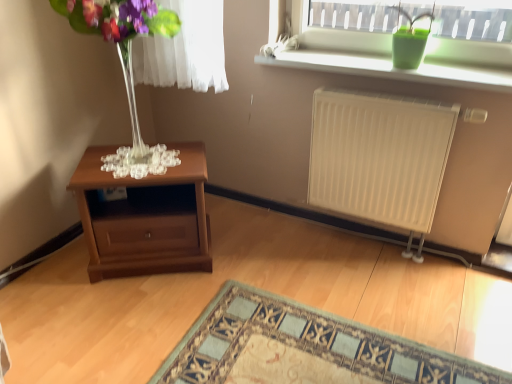
Question: Would you say green matte vase at upper right is a long distance from white matte radiator at right?

Choices:
 (A) yes
 (B) no

Answer: (B)

Question: Does green matte vase at upper right have a larger size compared to white matte radiator at right?

Choices:
 (A) yes
 (B) no

Answer: (B)

Question: Can you confirm if green matte vase at upper right is shorter than white matte radiator at right?

Choices:
 (A) yes
 (B) no

Answer: (A)

Question: Would you say white matte radiator at right is part of green matte vase at upper right's contents?

Choices:
 (A) no
 (B) yes

Answer: (A)

Question: Does green matte vase at upper right appear on the right side of white matte radiator at right?

Choices:
 (A) yes
 (B) no

Answer: (A)

Question: Would you say green matte vase at upper right is to the left or to the right of transparent glass vase at left in the picture?

Choices:
 (A) right
 (B) left

Answer: (A)

Question: Relative to transparent glass vase at left, is green matte vase at upper right in front or behind?

Choices:
 (A) behind
 (B) front

Answer: (A)

Question: Is green matte vase at upper right bigger or smaller than transparent glass vase at left?

Choices:
 (A) big
 (B) small

Answer: (B)

Question: From the image's perspective, relative to transparent glass vase at left, is green matte vase at upper right above or below?

Choices:
 (A) above
 (B) below

Answer: (A)

Question: Is mahogany wood nightstand at lower left wider or thinner than green matte vase at upper right?

Choices:
 (A) wide
 (B) thin

Answer: (A)

Question: Looking at the image, does mahogany wood nightstand at lower left seem bigger or smaller compared to green matte vase at upper right?

Choices:
 (A) small
 (B) big

Answer: (B)

Question: In the image, is mahogany wood nightstand at lower left positioned in front of or behind green matte vase at upper right?

Choices:
 (A) front
 (B) behind

Answer: (B)

Question: From the image's perspective, is mahogany wood nightstand at lower left positioned above or below green matte vase at upper right?

Choices:
 (A) below
 (B) above

Answer: (A)

Question: Is point (92, 241) positioned closer to the camera than point (132, 155)?

Choices:
 (A) closer
 (B) farther

Answer: (A)

Question: In terms of width, does mahogany wood nightstand at lower left look wider or thinner when compared to transparent glass vase at left?

Choices:
 (A) thin
 (B) wide

Answer: (B)